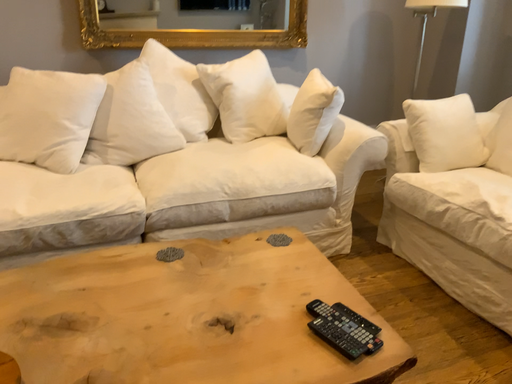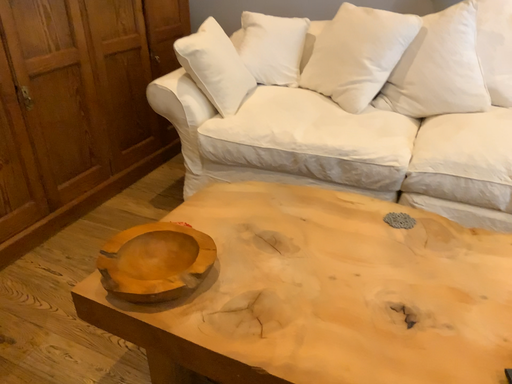
Question: How did the camera likely rotate when shooting the video?

Choices:
 (A) rotated right
 (B) rotated left

Answer: (B)